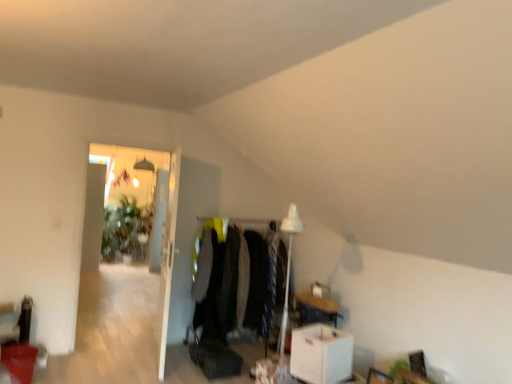
Question: Are white glossy door at upper left and transparent glass door at left making contact?

Choices:
 (A) yes
 (B) no

Answer: (B)

Question: Is white glossy door at upper left facing towards transparent glass door at left?

Choices:
 (A) no
 (B) yes

Answer: (B)

Question: Is white glossy door at upper left located outside transparent glass door at left?

Choices:
 (A) no
 (B) yes

Answer: (B)

Question: Is white glossy door at upper left further to the viewer compared to transparent glass door at left?

Choices:
 (A) yes
 (B) no

Answer: (B)

Question: Is white glossy door at upper left at the right side of transparent glass door at left?

Choices:
 (A) no
 (B) yes

Answer: (B)

Question: In terms of height, does white glossy door at upper left look taller or shorter compared to transparent glass door at left?

Choices:
 (A) short
 (B) tall

Answer: (A)

Question: Would you say white glossy door at upper left is to the left or to the right of transparent glass door at left in the picture?

Choices:
 (A) left
 (B) right

Answer: (B)

Question: Looking at their shapes, would you say white glossy door at upper left is wider or thinner than transparent glass door at left?

Choices:
 (A) wide
 (B) thin

Answer: (B)

Question: Based on their sizes in the image, would you say white glossy door at upper left is bigger or smaller than transparent glass door at left?

Choices:
 (A) small
 (B) big

Answer: (A)

Question: Is velvet black coat at center to the left or to the right of white glossy door at upper left in the image?

Choices:
 (A) left
 (B) right

Answer: (B)

Question: Is velvet black coat at center wider or thinner than white glossy door at upper left?

Choices:
 (A) thin
 (B) wide

Answer: (B)

Question: Does point (260, 286) appear closer or farther from the camera than point (167, 284)?

Choices:
 (A) farther
 (B) closer

Answer: (A)

Question: From the image's perspective, is velvet black coat at center above or below white glossy door at upper left?

Choices:
 (A) above
 (B) below

Answer: (B)

Question: From their relative heights in the image, would you say white cardboard box at lower right is taller or shorter than velvet black coat at center?

Choices:
 (A) short
 (B) tall

Answer: (A)

Question: From the image's perspective, is white cardboard box at lower right positioned above or below velvet black coat at center?

Choices:
 (A) above
 (B) below

Answer: (B)